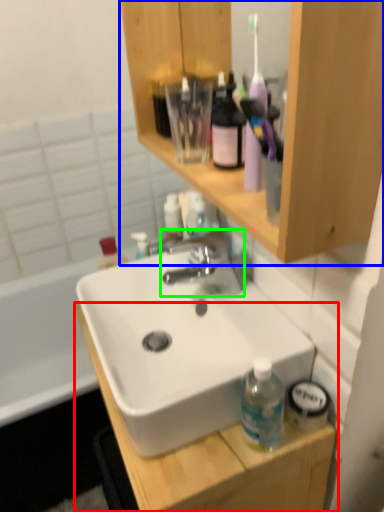
Question: Which is farther away from cabinetry (highlighted by a red box)? bathroom cabinet (highlighted by a blue box) or tap (highlighted by a green box)?

Choices:
 (A) bathroom cabinet
 (B) tap

Answer: (A)